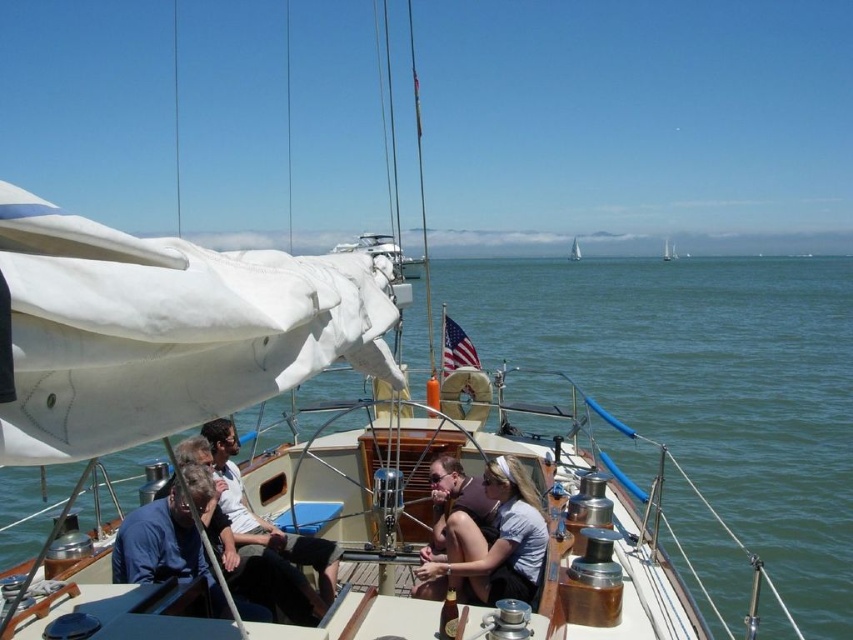
Question: Is white cotton shirt at center above white canvas sailboat at center?

Choices:
 (A) no
 (B) yes

Answer: (A)

Question: Which point is farther to the camera?

Choices:
 (A) (665, 253)
 (B) (579, 250)
 (C) (196, 508)
 (D) (209, 440)

Answer: (B)

Question: Estimate the real-world distances between objects in this image. Which object is closer to the matte brown hair at center?

Choices:
 (A) white canvas sailboat at center
 (B) white matte sailboat at center

Answer: (B)

Question: Estimate the real-world distances between objects in this image. Which object is farther from the white cotton shirt at center?

Choices:
 (A) blue fabric shirt at lower left
 (B) matte brown hair at center
 (C) white canvas sailboat at center
 (D) white matte sailboat at center

Answer: (C)

Question: Considering the relative positions of blue fabric shirt at lower left and white canvas sailboat at center in the image provided, where is blue fabric shirt at lower left located with respect to white canvas sailboat at center?

Choices:
 (A) above
 (B) below

Answer: (B)

Question: Does blue fabric shirt at lower left appear under white cotton shirt at center?

Choices:
 (A) yes
 (B) no

Answer: (A)